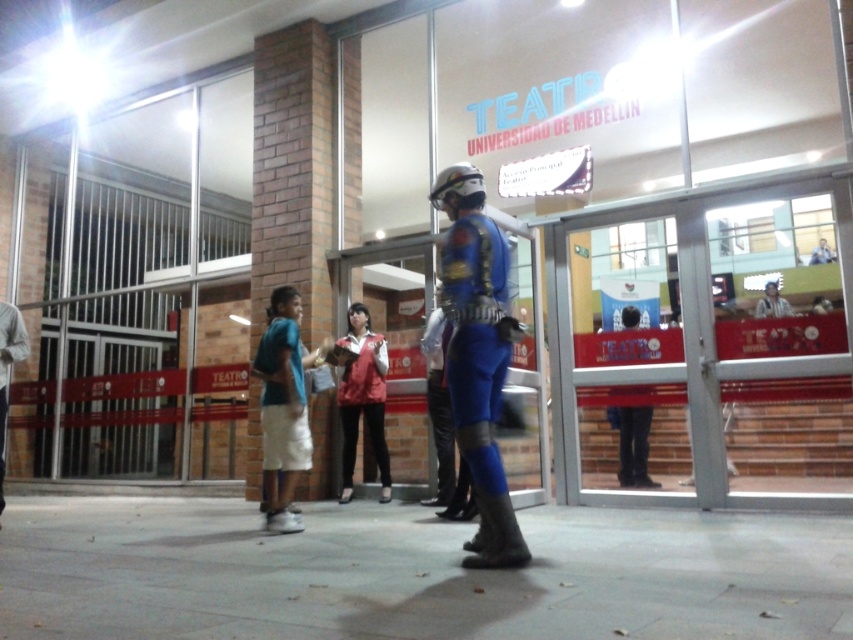
Does red fabric jacket at center have a greater height compared to dark blue fabric pants at center?

Yes.

Between point (374, 381) and point (637, 422), which one is positioned behind?

Positioned behind is point (637, 422).

Who is more forward, (x=352, y=337) or (x=634, y=467)?

Positioned in front is point (x=352, y=337).

Identify the location of red fabric jacket at center. Image resolution: width=853 pixels, height=640 pixels. (363, 397).

Is blue matte suit at center taller than dark blue fabric pants at center?

Correct, blue matte suit at center is much taller as dark blue fabric pants at center.

Which is above, blue matte suit at center or dark blue fabric pants at center?

blue matte suit at center

The height and width of the screenshot is (640, 853). Find the location of `blue matte suit at center`. blue matte suit at center is located at coordinates (479, 355).

You are a GUI agent. You are given a task and a screenshot of the screen. Output one action in this format:
    pyautogui.click(x=<x>, y=<y>)
    Task: Click on the blue matte suit at center
    Image resolution: width=853 pixels, height=640 pixels.
    Given the screenshot: What is the action you would take?
    (479, 355)

Measure the distance between blue matte suit at center and blue-green fabric shirt at center-left.

blue matte suit at center is 5.04 feet from blue-green fabric shirt at center-left.

What do you see at coordinates (479, 355) in the screenshot? This screenshot has width=853, height=640. I see `blue matte suit at center` at bounding box center [479, 355].

Locate an element on the screen. blue matte suit at center is located at coordinates click(x=479, y=355).